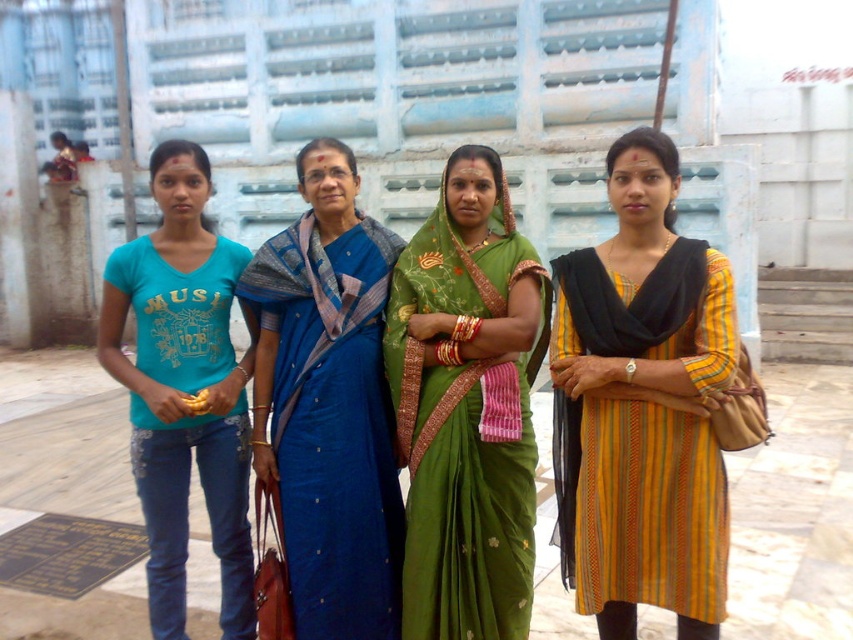
Locate an element on the screen. This screenshot has height=640, width=853. yellow striped dress at center is located at coordinates (642, 406).

Which is more to the right, yellow striped dress at center or teal t-shirt at left?

From the viewer's perspective, yellow striped dress at center appears more on the right side.

Where is `yellow striped dress at center`? The image size is (853, 640). yellow striped dress at center is located at coordinates (642, 406).

Image resolution: width=853 pixels, height=640 pixels. I want to click on yellow striped dress at center, so click(x=642, y=406).

Which of these two, green silk saree at center or blue silk saree at center, stands taller?

Standing taller between the two is blue silk saree at center.

Is point (463, 557) positioned after point (329, 244)?

No.

This screenshot has height=640, width=853. In order to click on green silk saree at center in this screenshot , I will do `click(467, 406)`.

Who is shorter, green silk saree at center or teal t-shirt at left?

With less height is green silk saree at center.

Describe the element at coordinates (467, 406) in the screenshot. I see `green silk saree at center` at that location.

Does point (415, 394) come behind point (223, 353)?

No.

The width and height of the screenshot is (853, 640). What are the coordinates of `green silk saree at center` in the screenshot? It's located at (467, 406).